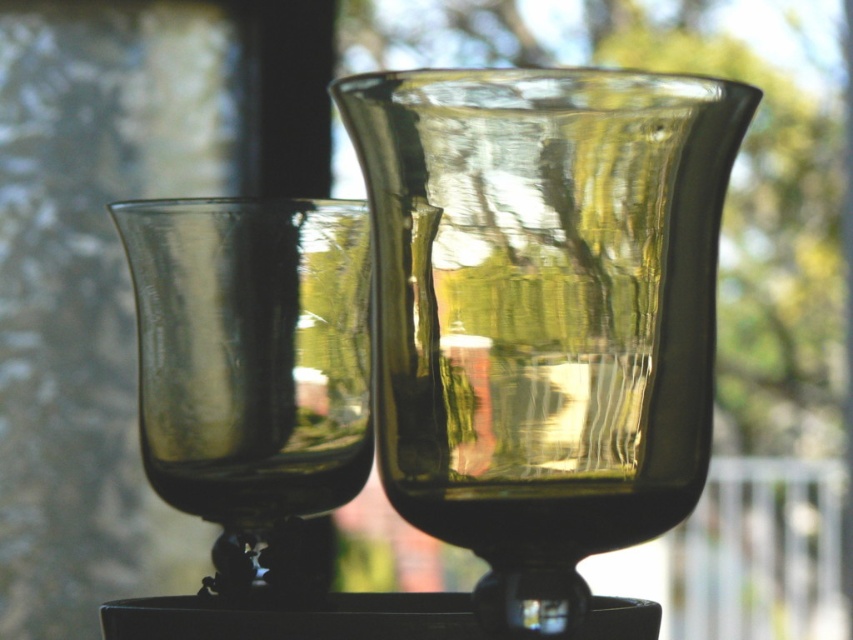
Measure the distance from transparent glass vase at center to transparent glass wine glass at center.

transparent glass vase at center and transparent glass wine glass at center are 2.59 inches apart from each other.

Which is behind, point (491, 400) or point (335, 468)?

The point (335, 468) is more distant.

Measure the distance between transparent glass vase at center and camera.

transparent glass vase at center is 19.44 centimeters from camera.

Identify the location of transparent glass vase at center. The image size is (853, 640). (543, 310).